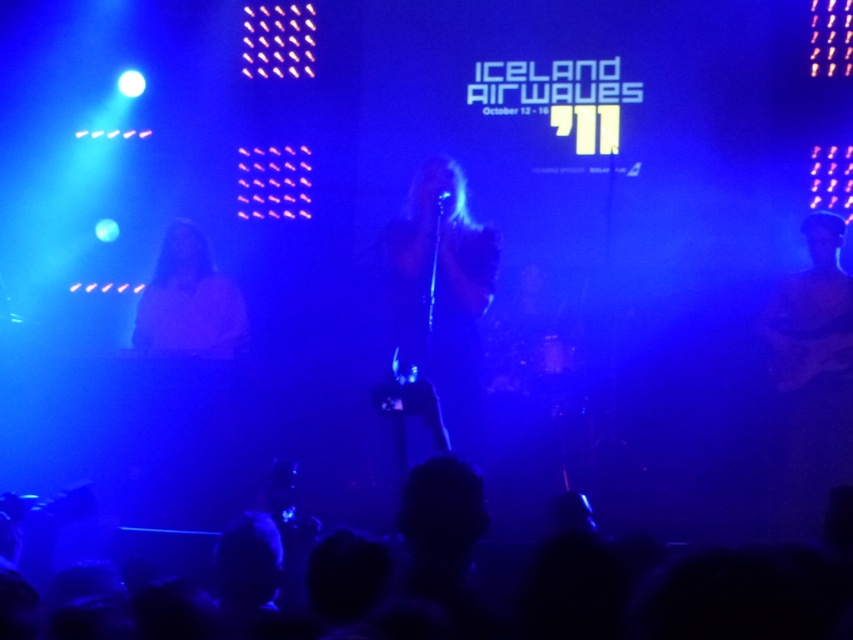
You are standing at the camera position and want to take a photo of the central female performer holding a microphone. The focus distance of your camera is set to 4.33 meters. Will the point at coordinates point [437,355] be in focus?

Yes, the point at coordinates point [437,355] is exactly 4.33 meters from the camera, so it will be in focus.

You are a photographer at the Iceland Airwaves festival. You need to capture a photo where the black matte shirt at center and the matte white shirt at center are both visible. Which shirt should you focus on to ensure both are in frame?

The black matte shirt at center is taller than the matte white shirt at center, so focusing on the black matte shirt at center will ensure both shirts are within the frame since it occupies a larger vertical space.

You are a photographer at the Iceland Airwaves festival. You want to capture a photo where the black matte shirt at center and the matte white shirt at center are both visible. Based on their positions, which shirt will appear closer to the camera in the final photo?

The black matte shirt at center is positioned under the matte white shirt at center, so the matte white shirt at center will appear closer to the camera in the photo.